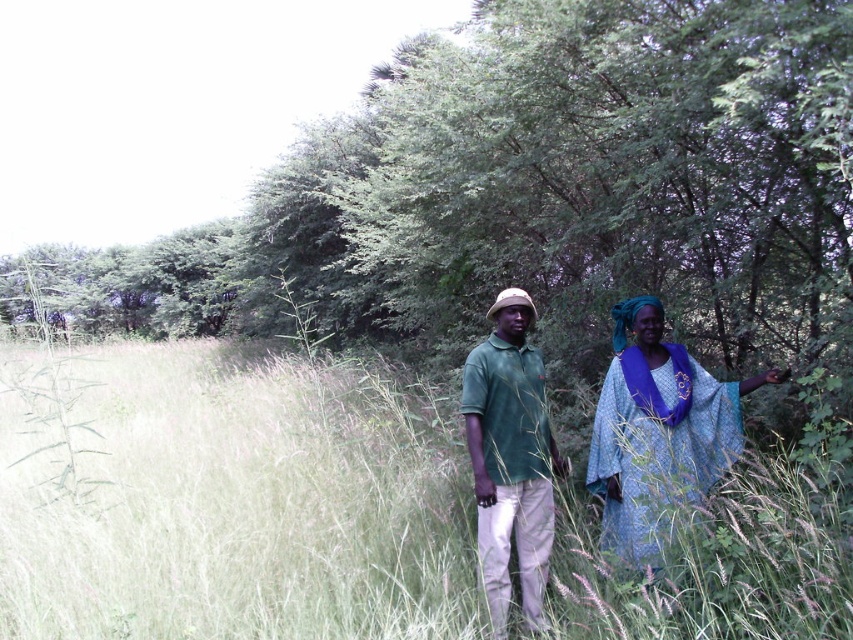
Question: Which object is the farthest from the green grass at center?

Choices:
 (A) green matte shirt at center
 (B) blue fabric at right

Answer: (A)

Question: Among these points, which one is farthest from the camera?

Choices:
 (A) (527, 392)
 (B) (294, 570)

Answer: (B)

Question: Where is green grass at center located in relation to blue fabric at right in the image?

Choices:
 (A) left
 (B) right

Answer: (A)

Question: Observing the image, what is the correct spatial positioning of blue fabric at right in reference to green matte shirt at center?

Choices:
 (A) right
 (B) left

Answer: (A)

Question: Among these objects, which one is nearest to the camera?

Choices:
 (A) green grass at center
 (B) green matte shirt at center
 (C) blue fabric at right

Answer: (A)

Question: Is the position of blue fabric at right less distant than that of green matte shirt at center?

Choices:
 (A) yes
 (B) no

Answer: (A)